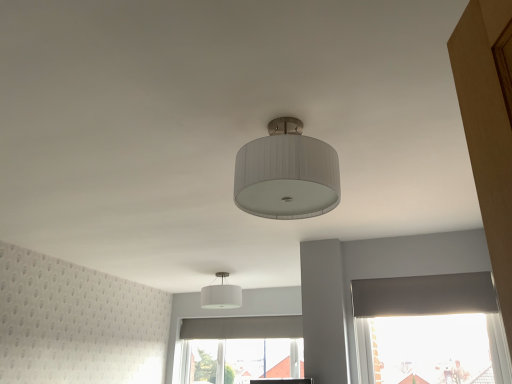
At what (x,y) coordinates should I click in order to perform the action: click on transparent plastic window screen at lower right. Please return your answer as a coordinate pair (x, y). This screenshot has width=512, height=384. Looking at the image, I should click on (432, 348).

Describe the element at coordinates (432, 348) in the screenshot. The image size is (512, 384). I see `transparent plastic window screen at lower right` at that location.

Where is `white textured lampshade at center, the 1th lamp in the front-to-back sequence`? The width and height of the screenshot is (512, 384). white textured lampshade at center, the 1th lamp in the front-to-back sequence is located at coordinates (286, 174).

What do you see at coordinates (221, 295) in the screenshot? I see `white fabric lampshade at center, acting as the 1th lamp starting from the bottom` at bounding box center [221, 295].

You are a GUI agent. You are given a task and a screenshot of the screen. Output one action in this format:
    pyautogui.click(x=<x>, y=<y>)
    Task: Click on the transparent plastic window screen at lower right
    This screenshot has height=384, width=512.
    Given the screenshot: What is the action you would take?
    pyautogui.click(x=432, y=348)

Is white textured lampshade at center, the 1th lamp in the front-to-back sequence, surrounded by white fabric lampshade at center, acting as the second lamp starting from the right?

No, white textured lampshade at center, the 1th lamp in the front-to-back sequence, is not inside white fabric lampshade at center, acting as the second lamp starting from the right.

At what (x,y) coordinates should I click in order to perform the action: click on lamp above the white textured lampshade at center, which is counted as the 2th lamp, starting from the bottom (from a real-world perspective). Please return your answer as a coordinate pair (x, y). The image size is (512, 384). Looking at the image, I should click on (221, 295).

From a real-world perspective, who is located higher, white fabric lampshade at center, the first lamp viewed from the back, or white textured lampshade at center, arranged as the second lamp when viewed from the left?

white fabric lampshade at center, the first lamp viewed from the back, is physically above.

Considering the positions of objects white textured lampshade at center, which is the first lamp from right to left, and transparent plastic window screen at lower right in the image provided, who is more to the right, white textured lampshade at center, which is the first lamp from right to left, or transparent plastic window screen at lower right?

transparent plastic window screen at lower right.

Consider the image. Are white textured lampshade at center, the second lamp viewed from the back, and transparent plastic window screen at lower right located far from each other?

Yes, white textured lampshade at center, the second lamp viewed from the back, is far from transparent plastic window screen at lower right.

From the image's perspective, relative to transparent plastic window screen at lower right, is white textured lampshade at center, acting as the 1th lamp starting from the top, above or below?

Clearly, from the image's perspective, white textured lampshade at center, acting as the 1th lamp starting from the top, is above transparent plastic window screen at lower right.

Does white fabric lampshade at center, which ranks as the 1th lamp in left-to-right order, appear on the left side of transparent plastic window screen at lower right?

Correct, you'll find white fabric lampshade at center, which ranks as the 1th lamp in left-to-right order, to the left of transparent plastic window screen at lower right.

Which is nearer, (228, 302) or (481, 315)?

The point (481, 315) is more forward.

From a real-world perspective, does white fabric lampshade at center, which ranks as the 1th lamp in left-to-right order, stand above transparent plastic window screen at lower right?

Yes, from a real-world perspective, white fabric lampshade at center, which ranks as the 1th lamp in left-to-right order, is above transparent plastic window screen at lower right.

Who is bigger, transparent plastic window screen at lower right or white textured lampshade at center, which is counted as the 2th lamp, starting from the bottom?

transparent plastic window screen at lower right.

Considering the sizes of transparent plastic window screen at lower right and white textured lampshade at center, arranged as the second lamp when viewed from the left, in the image, is transparent plastic window screen at lower right taller or shorter than white textured lampshade at center, arranged as the second lamp when viewed from the left,?

Considering their sizes, transparent plastic window screen at lower right has more height than white textured lampshade at center, arranged as the second lamp when viewed from the left.

From the image's perspective, which one is positioned higher, transparent plastic window screen at lower right or white textured lampshade at center, acting as the 1th lamp starting from the top?

white textured lampshade at center, acting as the 1th lamp starting from the top, appears higher in the image.

From a real-world perspective, is transparent plastic window screen at lower right located beneath white textured lampshade at center, acting as the 1th lamp starting from the top?

Yes, from a real-world perspective, transparent plastic window screen at lower right is under white textured lampshade at center, acting as the 1th lamp starting from the top.

How far apart are transparent plastic window screen at lower right and white fabric lampshade at center, which is the second lamp from top to bottom?

A distance of 2.05 meters exists between transparent plastic window screen at lower right and white fabric lampshade at center, which is the second lamp from top to bottom.

Is point (481, 353) more distant than point (236, 297)?

That is False.

Is transparent plastic window screen at lower right oriented towards white fabric lampshade at center, positioned as the second lamp in front-to-back order?

No, transparent plastic window screen at lower right is not turned towards white fabric lampshade at center, positioned as the second lamp in front-to-back order.

From a real-world perspective, which is physically below, transparent plastic window screen at lower right or white fabric lampshade at center, positioned as the second lamp in front-to-back order?

transparent plastic window screen at lower right is physically lower.

How different are the orientations of white textured lampshade at center, which is counted as the 2th lamp, starting from the bottom, and white fabric lampshade at center, which ranks as the 1th lamp in left-to-right order, in degrees?

There is a 1.69-degree angle between the facing directions of white textured lampshade at center, which is counted as the 2th lamp, starting from the bottom, and white fabric lampshade at center, which ranks as the 1th lamp in left-to-right order.

Which is nearer, (313, 186) or (209, 295)?

The point (313, 186) is closer.

Considering the relative sizes of white textured lampshade at center, the second lamp viewed from the back, and white fabric lampshade at center, which ranks as the 1th lamp in left-to-right order, in the image provided, is white textured lampshade at center, the second lamp viewed from the back, shorter than white fabric lampshade at center, which ranks as the 1th lamp in left-to-right order,?

No.

Is white fabric lampshade at center, which ranks as the 1th lamp in left-to-right order, at the back of white textured lampshade at center, which is counted as the 2th lamp, starting from the bottom?

No, white textured lampshade at center, which is counted as the 2th lamp, starting from the bottom, is not facing the opposite direction of white fabric lampshade at center, which ranks as the 1th lamp in left-to-right order.

Locate an element on the screen. lamp that appears above the white fabric lampshade at center, positioned as the second lamp in front-to-back order (from the image's perspective) is located at coordinates (286, 174).

Where is `the 1st lamp above the transparent plastic window screen at lower right (from a real-world perspective)`? the 1st lamp above the transparent plastic window screen at lower right (from a real-world perspective) is located at coordinates (286, 174).

Considering their positions, is white fabric lampshade at center, acting as the 1th lamp starting from the bottom, positioned closer to transparent plastic window screen at lower right than white textured lampshade at center, which is counted as the 2th lamp, starting from the bottom?

Based on the image, white fabric lampshade at center, acting as the 1th lamp starting from the bottom, appears to be nearer to transparent plastic window screen at lower right.

From the image, which object appears to be farther from white fabric lampshade at center, which is the second lamp from top to bottom, transparent plastic window screen at lower right or white textured lampshade at center, the 1th lamp in the front-to-back sequence?

white textured lampshade at center, the 1th lamp in the front-to-back sequence.

Looking at this image, considering their positions, is white textured lampshade at center, the 1th lamp in the front-to-back sequence, positioned closer to white fabric lampshade at center, which ranks as the 1th lamp in left-to-right order, than transparent plastic window screen at lower right?

The object closer to white fabric lampshade at center, which ranks as the 1th lamp in left-to-right order, is transparent plastic window screen at lower right.

Based on the photo, from the image, which object appears to be nearer to transparent plastic window screen at lower right, white textured lampshade at center, the second lamp viewed from the back, or white fabric lampshade at center, acting as the second lamp starting from the right?

Among the two, white fabric lampshade at center, acting as the second lamp starting from the right, is located nearer to transparent plastic window screen at lower right.

Which object lies nearer to the anchor point white textured lampshade at center, acting as the 1th lamp starting from the top, white fabric lampshade at center, which ranks as the 1th lamp in left-to-right order, or transparent plastic window screen at lower right?

Among the two, transparent plastic window screen at lower right is located nearer to white textured lampshade at center, acting as the 1th lamp starting from the top.

Looking at the image, which one is located further to white textured lampshade at center, arranged as the second lamp when viewed from the left, transparent plastic window screen at lower right or white fabric lampshade at center, positioned as the second lamp in front-to-back order?

The object further to white textured lampshade at center, arranged as the second lamp when viewed from the left, is white fabric lampshade at center, positioned as the second lamp in front-to-back order.

This screenshot has height=384, width=512. Find the location of `window screen between white textured lampshade at center, acting as the 1th lamp starting from the top, and white fabric lampshade at center, the first lamp viewed from the back, in the front-back direction`. window screen between white textured lampshade at center, acting as the 1th lamp starting from the top, and white fabric lampshade at center, the first lamp viewed from the back, in the front-back direction is located at coordinates (432, 348).